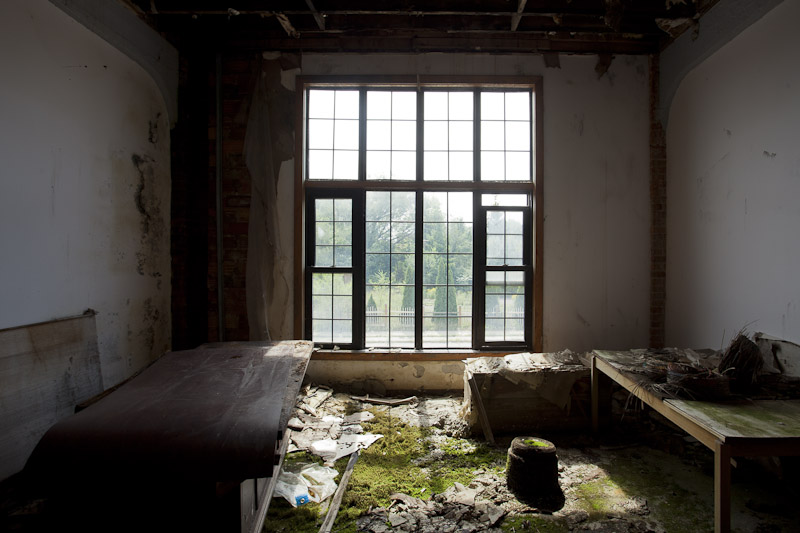
You are a GUI agent. You are given a task and a screenshot of the screen. Output one action in this format:
    pyautogui.click(x=<x>, y=<y>)
    Task: Click on the back wall
    The image size is (800, 533).
    Given the screenshot: What is the action you would take?
    pyautogui.click(x=598, y=286)